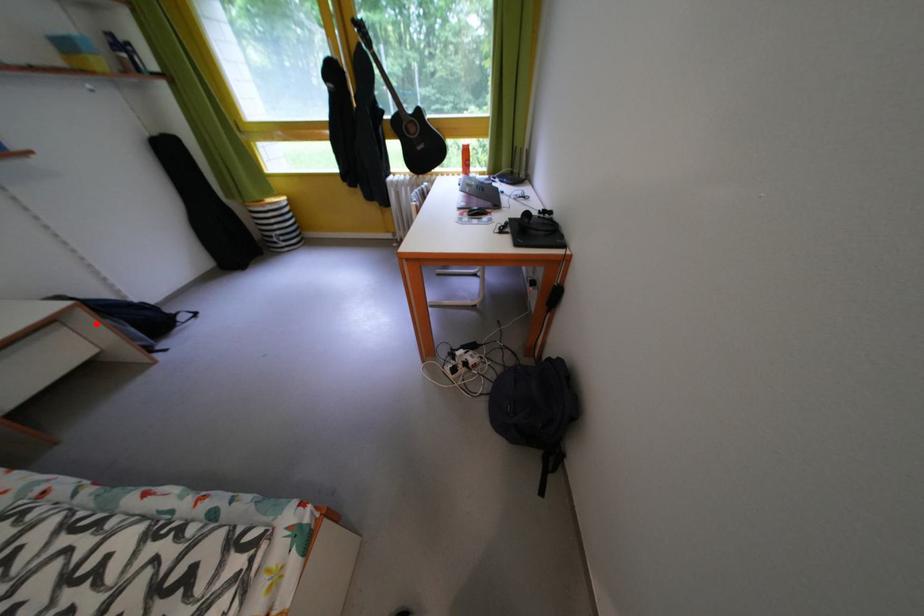
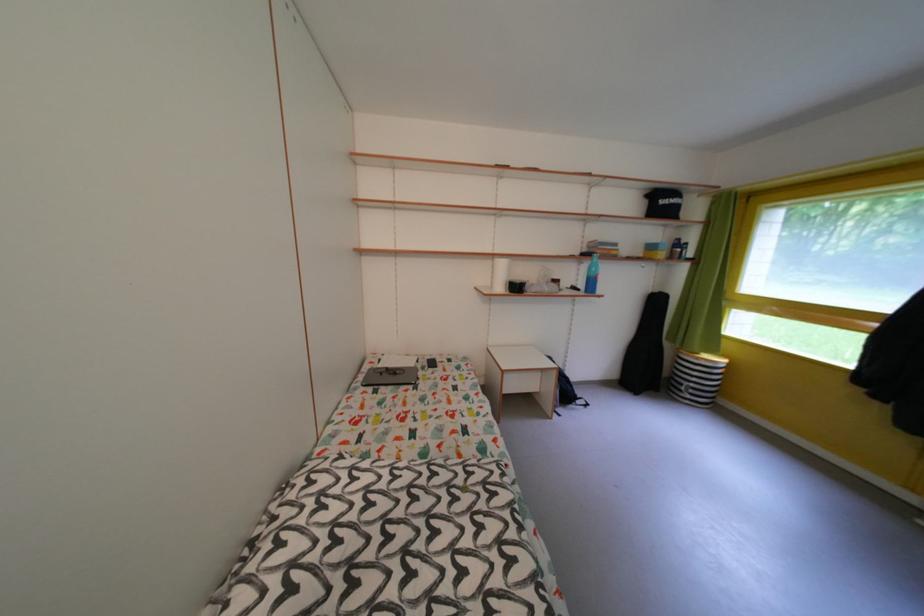
Question: I am providing you with two images of the same scene from different viewpoints. In image1, a red point is highlighted. Considering the same 3D point in image2, which of the following is correct?

Choices:
 (A) It is closer
 (B) It is farther

Answer: (B)